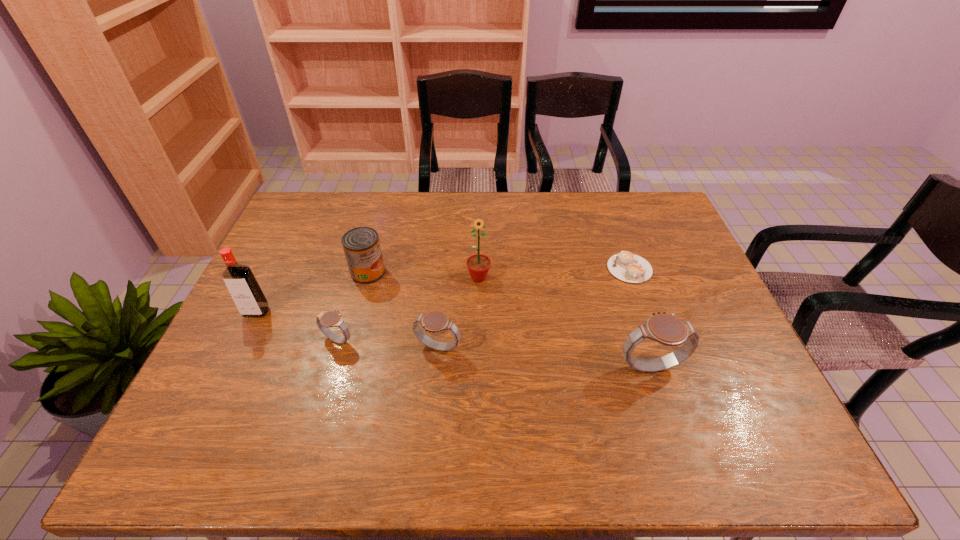
Locate which watch ranks second in proximity to the second watch from right to left. Please provide its 2D coordinates. Your answer should be formatted as a tuple, i.e. [(x, y)], where the tuple contains the x and y coordinates of a point satisfying the conditions above.

[(666, 329)]

Where is `vacant space that satisfies the following two spatial constraints: 1. on the front side of the fourth shortest object; 2. on the right side of the rightmost watch`? vacant space that satisfies the following two spatial constraints: 1. on the front side of the fourth shortest object; 2. on the right side of the rightmost watch is located at coordinates (343, 366).

I want to click on vacant region that satisfies the following two spatial constraints: 1. on the front and back of the fourth object from right to left; 2. on the left side of the leftmost object, so click(239, 348).

You are a GUI agent. You are given a task and a screenshot of the screen. Output one action in this format:
    pyautogui.click(x=<x>, y=<y>)
    Task: Click on the free space that satisfies the following two spatial constraints: 1. on the front and back of the tallest watch; 2. on the left side of the vodka
    Image resolution: width=960 pixels, height=540 pixels.
    Given the screenshot: What is the action you would take?
    pyautogui.click(x=230, y=366)

Find the location of a particular element. The height and width of the screenshot is (540, 960). vacant space that satisfies the following two spatial constraints: 1. on the front and back of the vodka; 2. on the right side of the shortest watch is located at coordinates (243, 340).